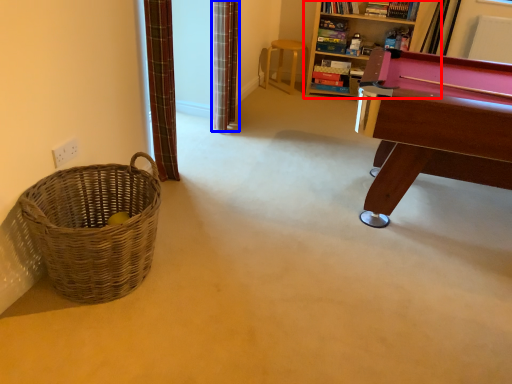
Question: Which point is further to the camera, bookcase (highlighted by a red box) or curtain (highlighted by a blue box)?

Choices:
 (A) bookcase
 (B) curtain

Answer: (A)